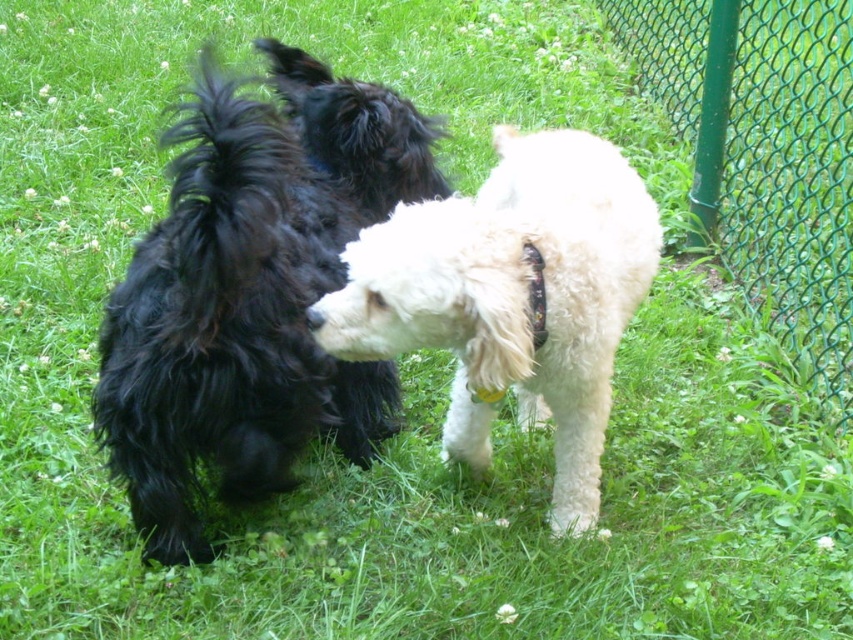
Question: Estimate the real-world distances between objects in this image. Which object is closer to the shiny black fur at center?

Choices:
 (A) green wire mesh fence at right
 (B) white fluffy dog at center

Answer: (B)

Question: Among these points, which one is farthest from the camera?

Choices:
 (A) (753, 179)
 (B) (309, 93)
 (C) (422, 211)

Answer: (A)

Question: Does shiny black fur at center appear over white fluffy dog at center?

Choices:
 (A) yes
 (B) no

Answer: (A)

Question: Which point is closer to the camera taking this photo?

Choices:
 (A) (602, 180)
 (B) (122, 333)
 (C) (795, 268)

Answer: (B)

Question: Considering the relative positions of shiny black fur at center and white fluffy dog at center in the image provided, where is shiny black fur at center located with respect to white fluffy dog at center?

Choices:
 (A) right
 (B) left

Answer: (B)

Question: Can you confirm if white fluffy dog at center is positioned below green wire mesh fence at right?

Choices:
 (A) yes
 (B) no

Answer: (A)